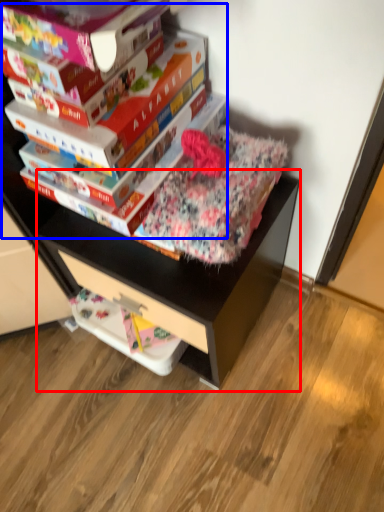
Question: Among these objects, which one is nearest to the camera, computer desk (highlighted by a red box) or paperback book (highlighted by a blue box)?

Choices:
 (A) computer desk
 (B) paperback book

Answer: (B)